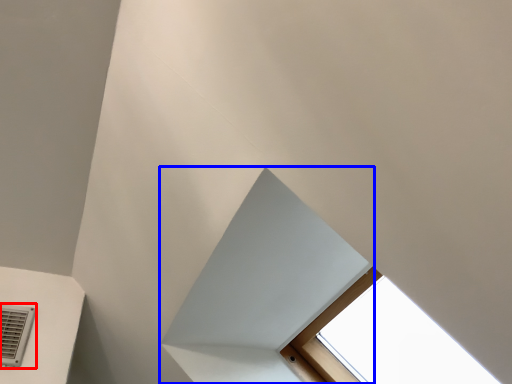
Question: Which of the following is the farthest to the observer, air conditioning (highlighted by a red box) or exhaust hood (highlighted by a blue box)?

Choices:
 (A) air conditioning
 (B) exhaust hood

Answer: (A)